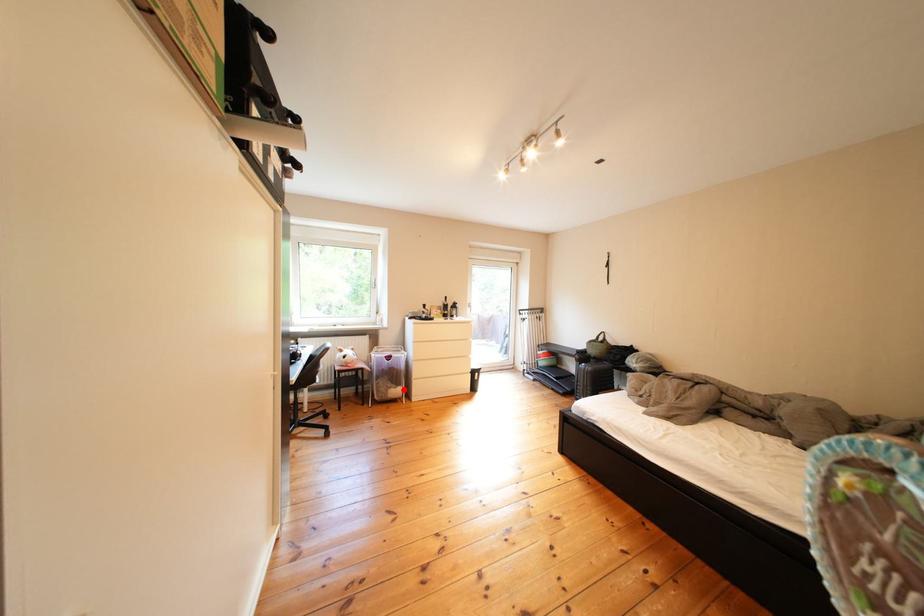
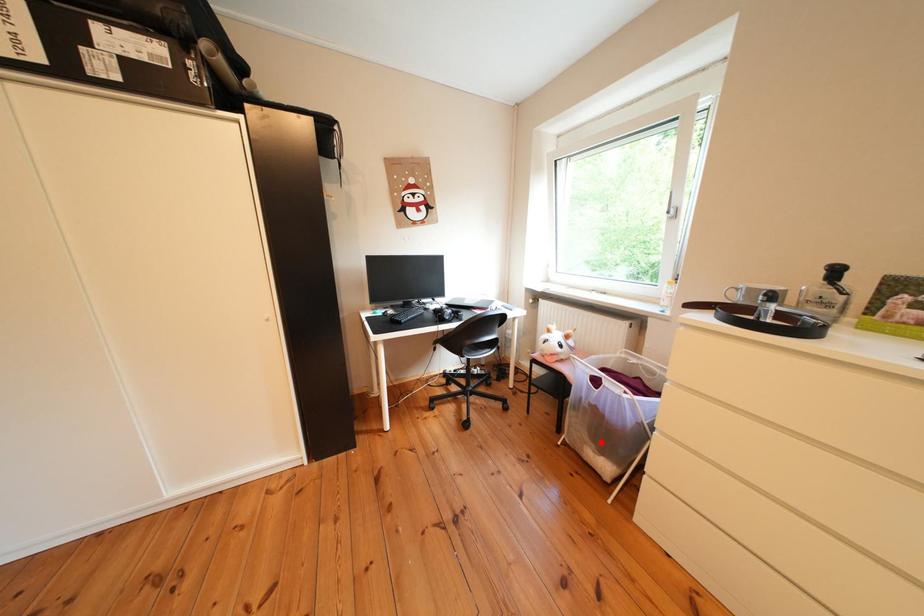
I am providing you with two images of the same scene from different viewpoints. A red point is marked on the first image and another point is marked on the second image. Are the points marked in image1 and image2 representing the same 3D position?

Yes